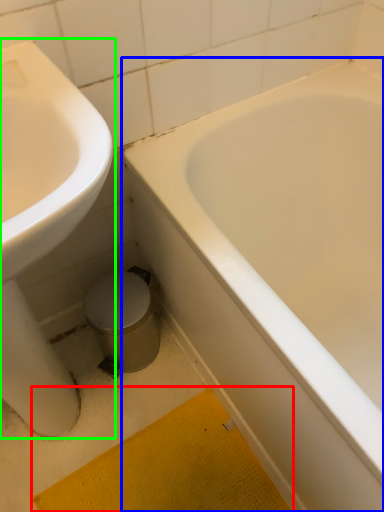
Question: Which object is the closest to the bath mat (highlighted by a red box)? Choose among these: bathtub (highlighted by a blue box) or sink (highlighted by a green box).

Choices:
 (A) bathtub
 (B) sink

Answer: (B)